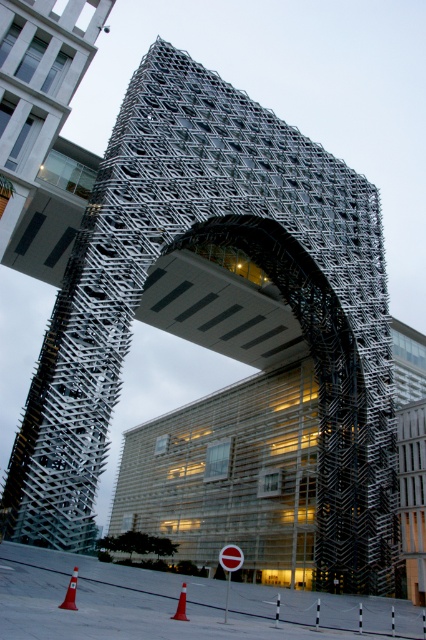
Question: Which point is farther to the camera?

Choices:
 (A) (71, 589)
 (B) (235, 560)

Answer: (B)

Question: Which is farther from the orange plastic cone at lower center?

Choices:
 (A) red matte stop sign at center
 (B) orange plastic cone at lower left

Answer: (A)

Question: From the image, what is the correct spatial relationship of red matte stop sign at center in relation to orange plastic cone at lower center?

Choices:
 (A) below
 (B) above

Answer: (A)

Question: Is red matte stop sign at center to the right of orange plastic cone at lower left from the viewer's perspective?

Choices:
 (A) yes
 (B) no

Answer: (A)

Question: Which is farther from the red matte stop sign at center?

Choices:
 (A) orange plastic cone at lower center
 (B) orange plastic cone at lower left

Answer: (A)

Question: Does red matte stop sign at center have a greater width compared to orange plastic cone at lower left?

Choices:
 (A) no
 (B) yes

Answer: (B)